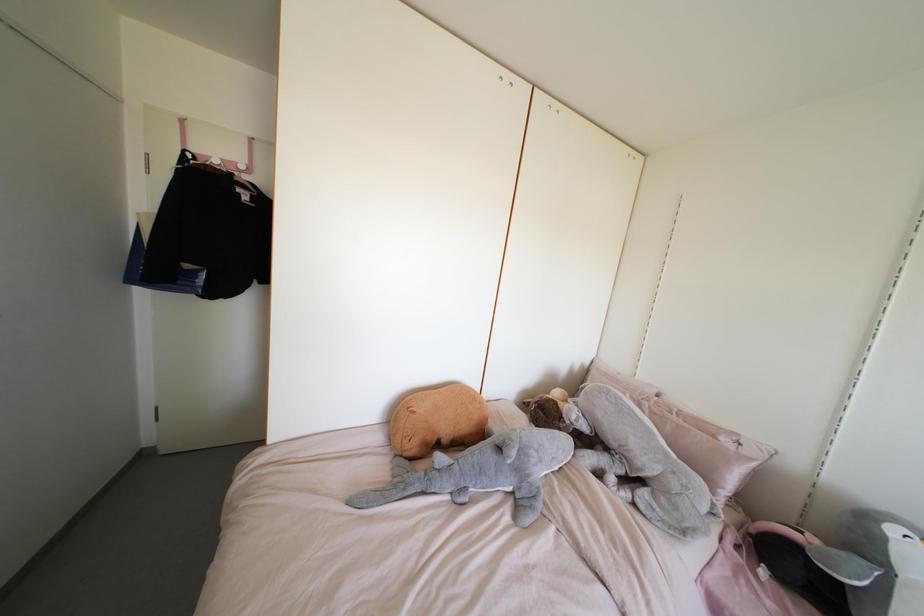
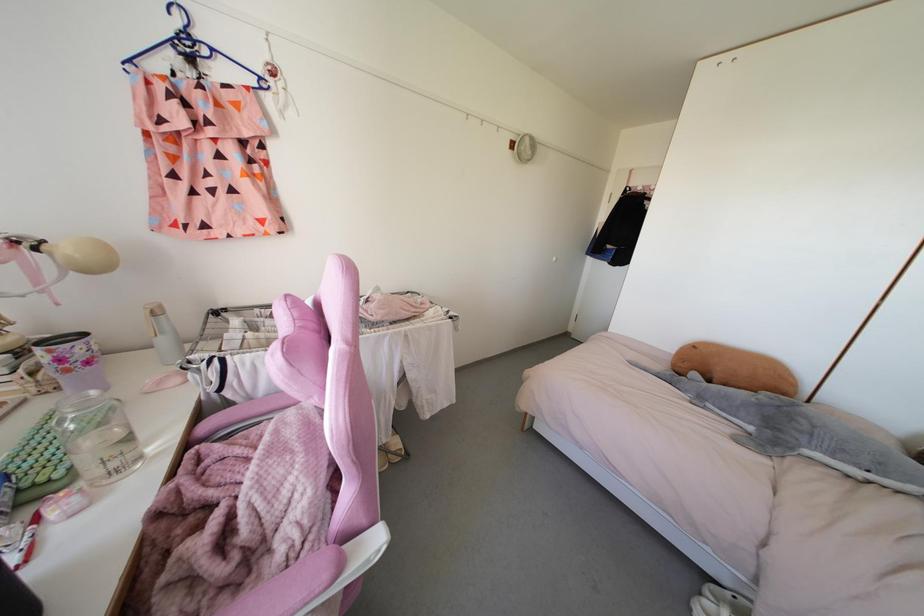
Where in the second image is the point corresponding to point (553, 458) from the first image?

(843, 450)